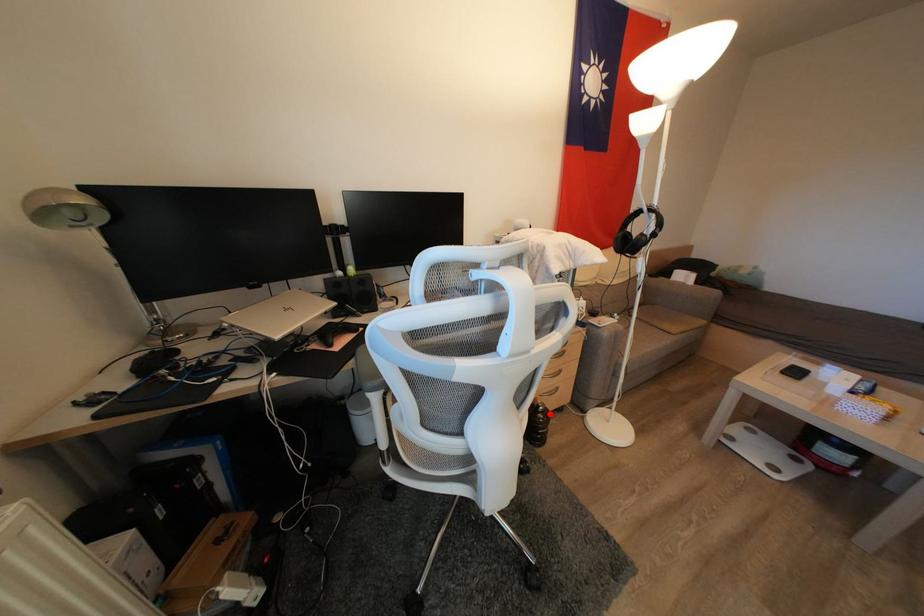
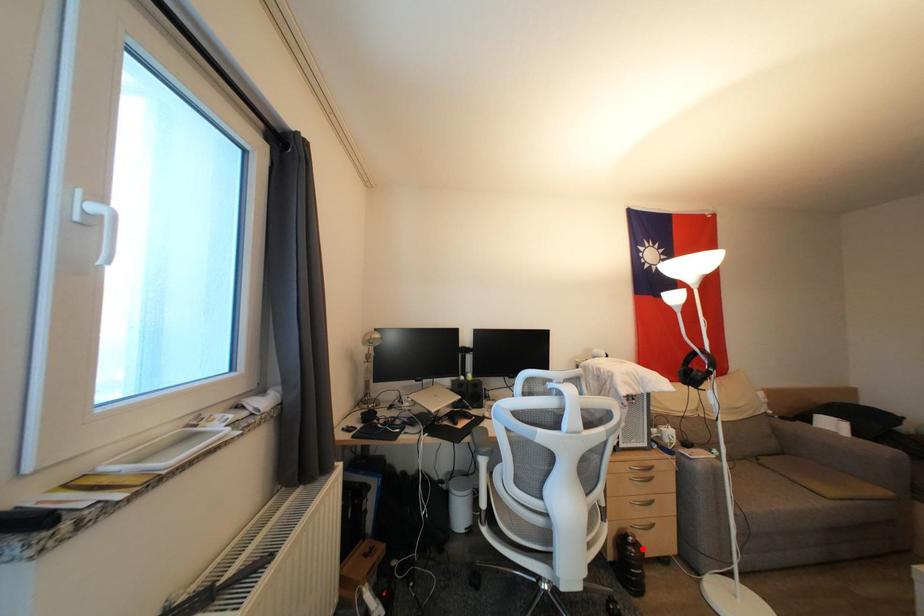
I am providing you with two images of the same scene from different viewpoints. A red point is marked on the first image and another point is marked on the second image. Is the red point in image1 aligned with the point shown in image2?

Yes